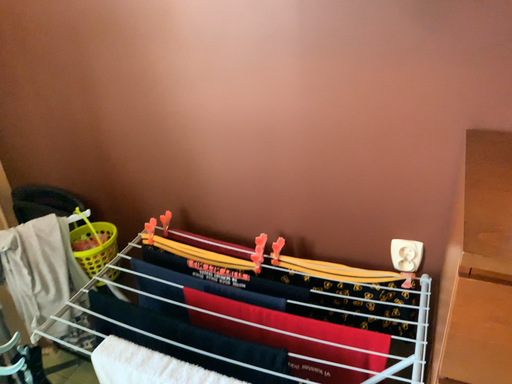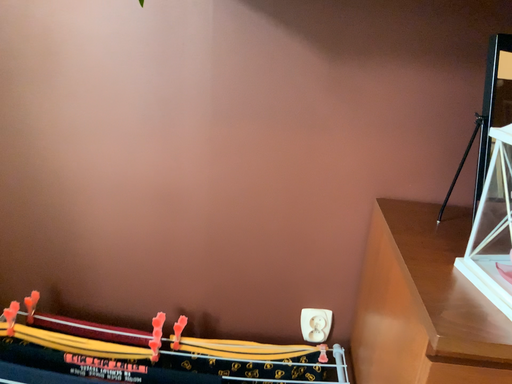
Question: Which way did the camera rotate in the video?

Choices:
 (A) rotated downward
 (B) rotated upward

Answer: (B)